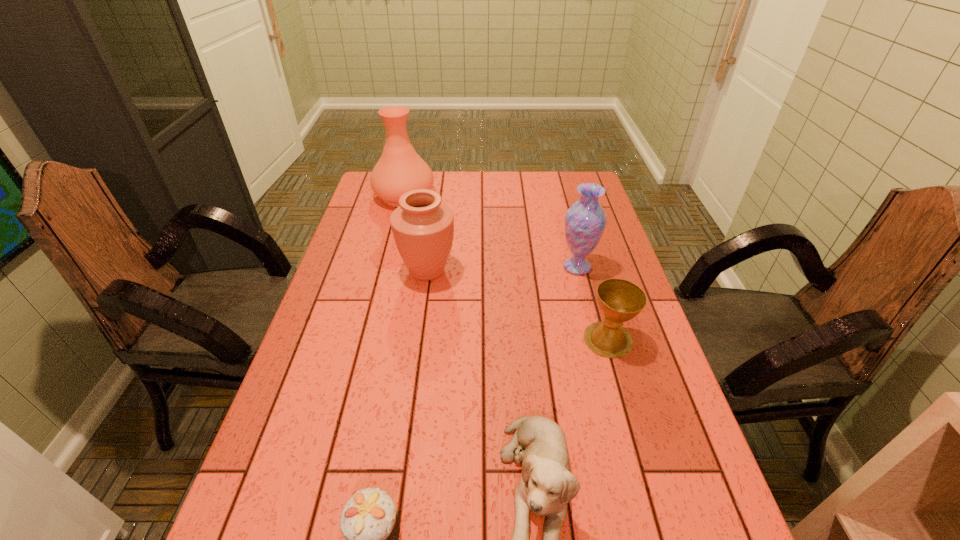
I want to click on vase that can be found as the second closest to the tallest object, so click(585, 221).

Locate an element on the screen. The height and width of the screenshot is (540, 960). vase that is the second closest to the rightmost vase is located at coordinates (400, 169).